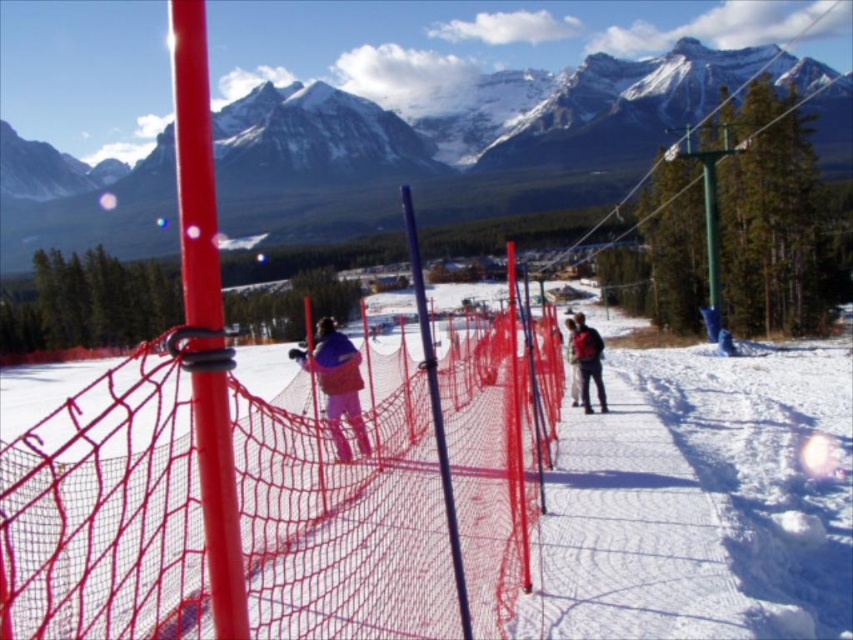
Is snowy mountain at upper center to the left of smooth plastic pole at center from the viewer's perspective?

Correct, you'll find snowy mountain at upper center to the left of smooth plastic pole at center.

Who is positioned more to the right, snowy mountain at upper center or smooth plastic pole at center?

From the viewer's perspective, smooth plastic pole at center appears more on the right side.

At what (x,y) coordinates should I click in order to perform the action: click on snowy mountain at upper center. Please return your answer as a coordinate pair (x, y). Looking at the image, I should click on (459, 138).

Locate an element on the screen. This screenshot has height=640, width=853. snowy mountain at upper center is located at coordinates (459, 138).

The image size is (853, 640). What do you see at coordinates (206, 317) in the screenshot? I see `smooth plastic pole at center` at bounding box center [206, 317].

Which is more to the right, smooth plastic pole at center or matte blue jacket at center?

matte blue jacket at center is more to the right.

Which is behind, point (181, 225) or point (360, 376)?

Point (360, 376)

This screenshot has width=853, height=640. What are the coordinates of `smooth plastic pole at center` in the screenshot? It's located at [206, 317].

Does metallic blue pole at center lie in front of white snow pants at center?

Yes, it is in front of white snow pants at center.

Is metallic blue pole at center bigger than white snow pants at center?

No.

Find the location of a particular element. The image size is (853, 640). metallic blue pole at center is located at coordinates (436, 412).